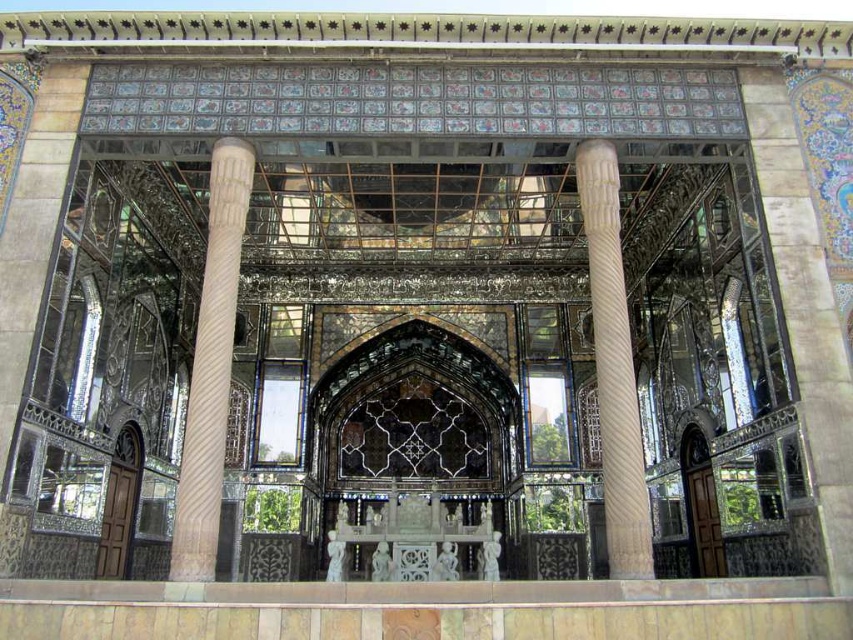
Consider the image. You are an architect designing a replica of this space. You need to ensure that the white marble column at center and the carved stone column at center are proportionate. Which column should have a larger diameter in your design?

The white marble column at center should have a larger diameter than the carved stone column at center since the description states that the white marble column at center is wider.

You are standing in the grand structure and want to touch both the white marble column at center and the carved stone column at center. Which column should you approach first to reach the closer one?

You should approach the white marble column at center first because it is closer to you than the carved stone column at center.

You are an architect analyzing the structural integrity of the columns in this building. Given that the white marble column at center is not as tall as the carved stone column at center, which column might be more likely to support heavier loads without bending?

The carved stone column at center is taller and likely stronger, so it can support heavier loads without bending.